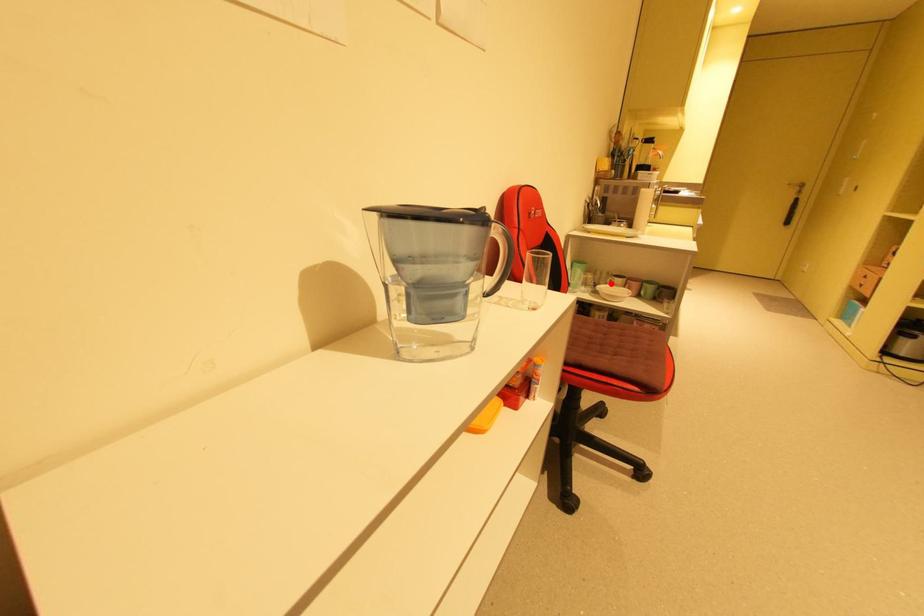
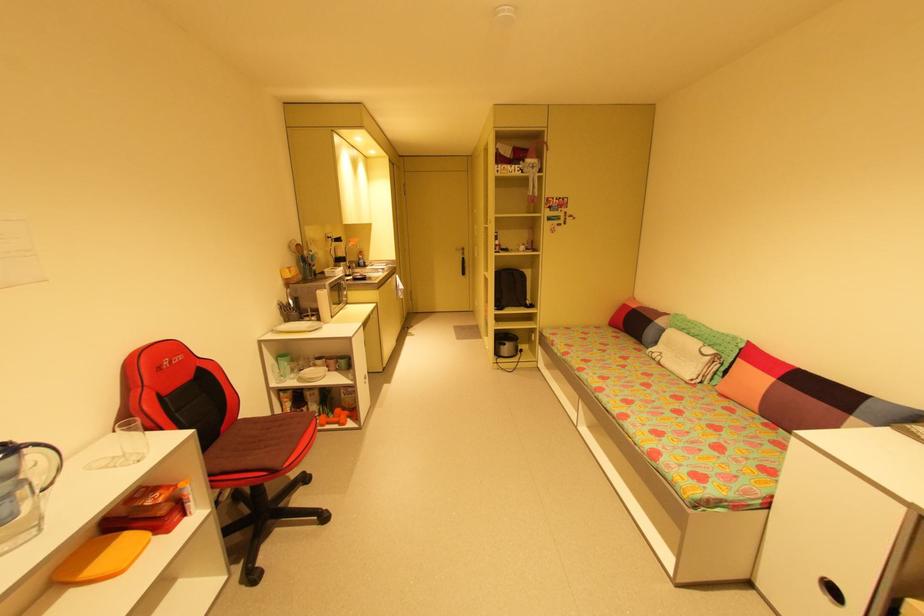
The point at the highlighted location is marked in the first image. Where is the corresponding point in the second image?

(313, 367)